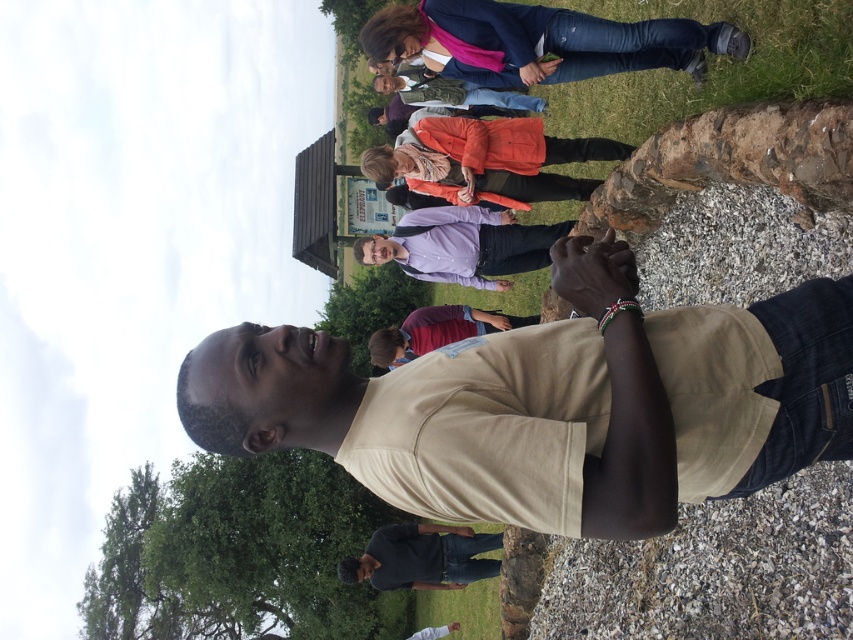
You are a photographer trying to capture the beige cotton shirt at center in the frame. Based on its 2D coordinates, is it positioned closer to the top or bottom of the image?

The beige cotton shirt at center is positioned closer to the bottom of the image since its y coordinate is 0.649, which is closer to 1.0 than 0.0 in a typical coordinate system where the origin is at the bottom left.

Consider the image. You are part of a group taking a tour and need to locate your guide. The guide is wearing a beige cotton shirt at center. From the perspective of someone standing where the maroon fabric shirt at center is, which direction should you look to find the guide?

The beige cotton shirt at center is to the right of the maroon fabric shirt at center, so from the perspective of the maroon fabric shirt at center, you should look to your right to find the guide.